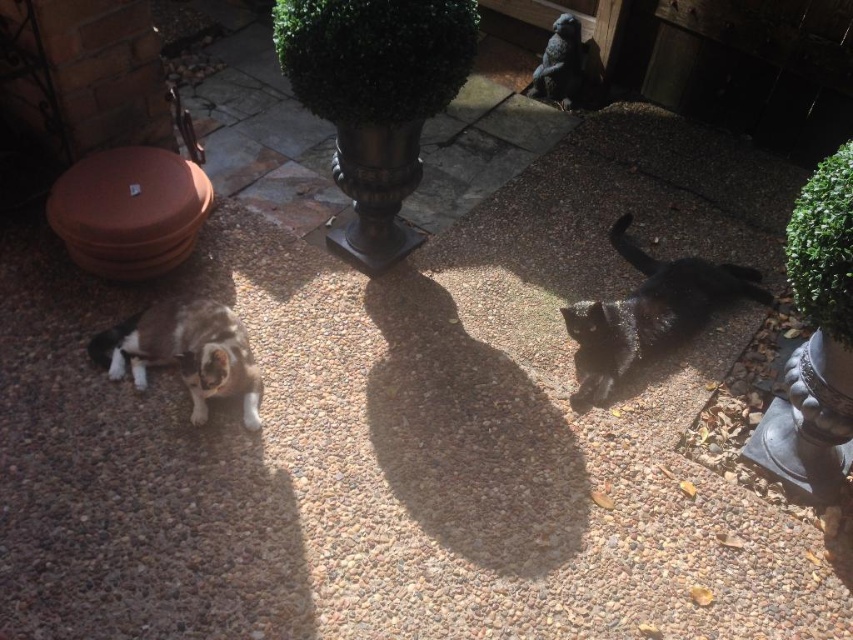
Does point (747, 282) lie behind point (154, 332)?

Yes, point (747, 282) is farther from viewer.

Measure the distance from black glossy cat at right to calico fur cat at lower left.

The distance of black glossy cat at right from calico fur cat at lower left is 1.46 meters.

You are a GUI agent. You are given a task and a screenshot of the screen. Output one action in this format:
    pyautogui.click(x=<x>, y=<y>)
    Task: Click on the black glossy cat at right
    This screenshot has width=853, height=640.
    Given the screenshot: What is the action you would take?
    pyautogui.click(x=648, y=312)